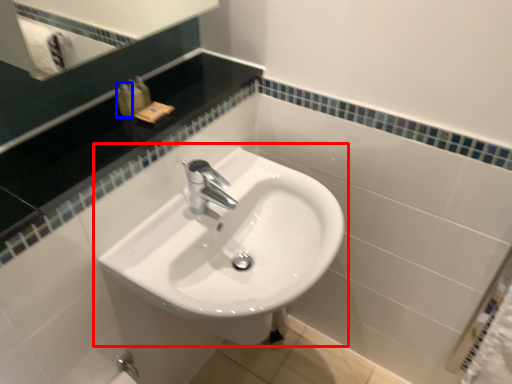
Question: Which of the following is the farthest to the observer, sink (highlighted by a red box) or toiletry (highlighted by a blue box)?

Choices:
 (A) sink
 (B) toiletry

Answer: (B)